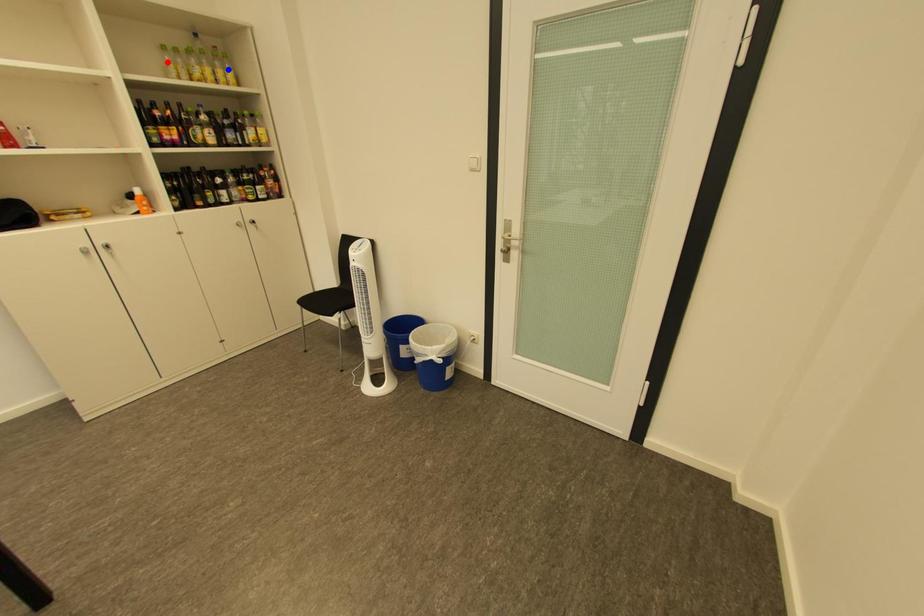
Question: Which of the two points in the image is closer to the camera?

Choices:
 (A) Blue point is closer.
 (B) Red point is closer.

Answer: (B)